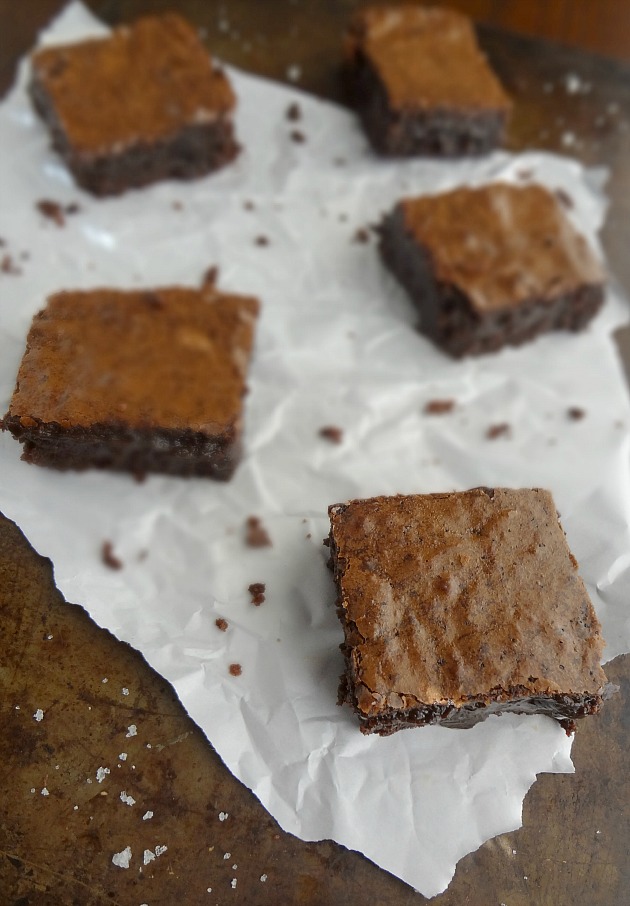
Where is `brown table`? This screenshot has width=630, height=906. brown table is located at coordinates (82, 692).